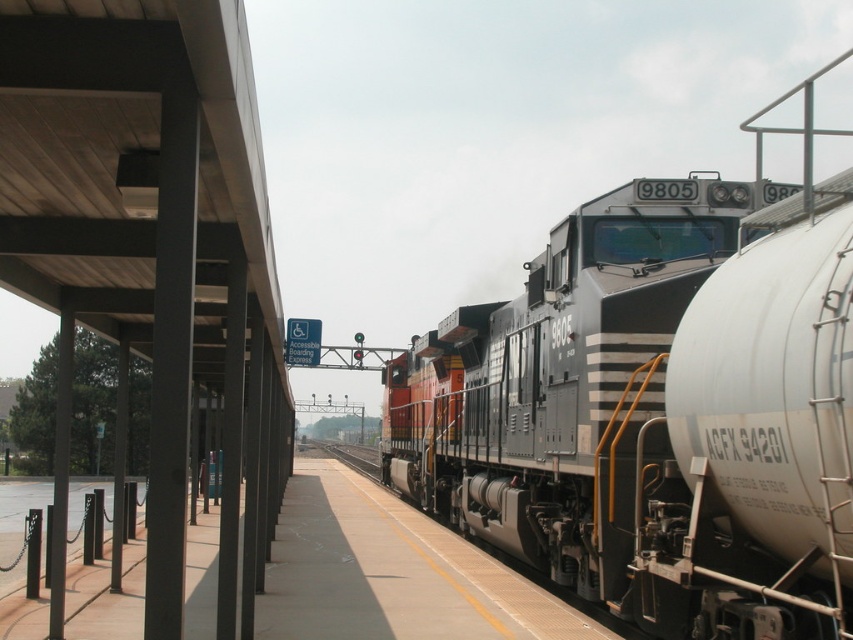
Is black metal train at center positioned at the back of concrete platform at center?

No, it is in front of concrete platform at center.

At what (x,y) coordinates should I click in order to perform the action: click on black metal train at center. Please return your answer as a coordinate pair (x, y). Image resolution: width=853 pixels, height=640 pixels. Looking at the image, I should click on (659, 404).

Can you confirm if black metal train at center is smaller than black metal train track at center?

No, black metal train at center is not smaller than black metal train track at center.

Is point (639, 608) positioned behind point (347, 464)?

No, it is in front of (347, 464).

Between point (769, 289) and point (376, 465), which one is positioned in front?

Point (769, 289)

Where is `black metal train at center`? The height and width of the screenshot is (640, 853). black metal train at center is located at coordinates (659, 404).

Is concrete platform at center smaller than black metal train track at center?

Correct, concrete platform at center occupies less space than black metal train track at center.

Between concrete platform at center and black metal train track at center, which one has more height?

black metal train track at center is taller.

Is point (357, 490) behind point (370, 458)?

That is False.

The image size is (853, 640). Find the location of `concrete platform at center`. concrete platform at center is located at coordinates (392, 573).